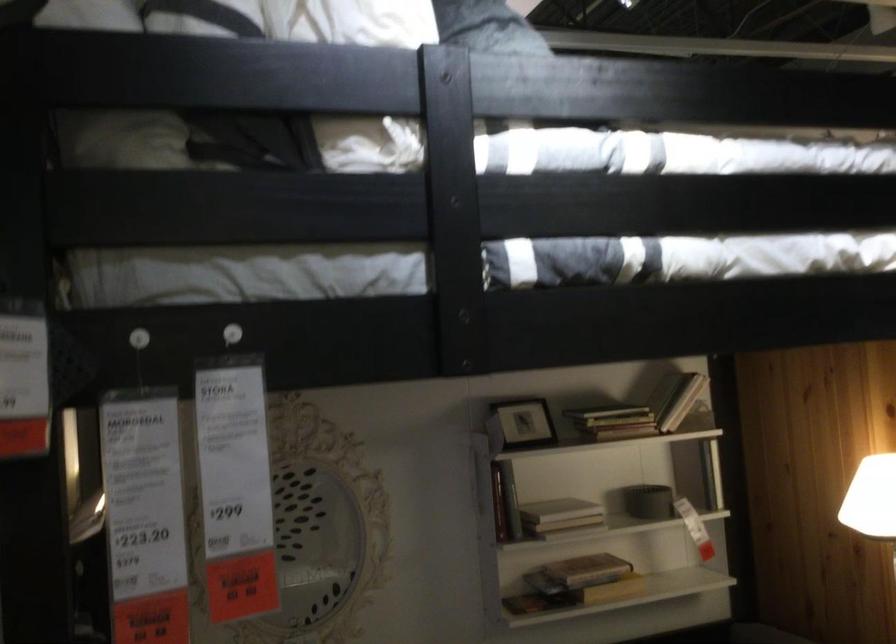
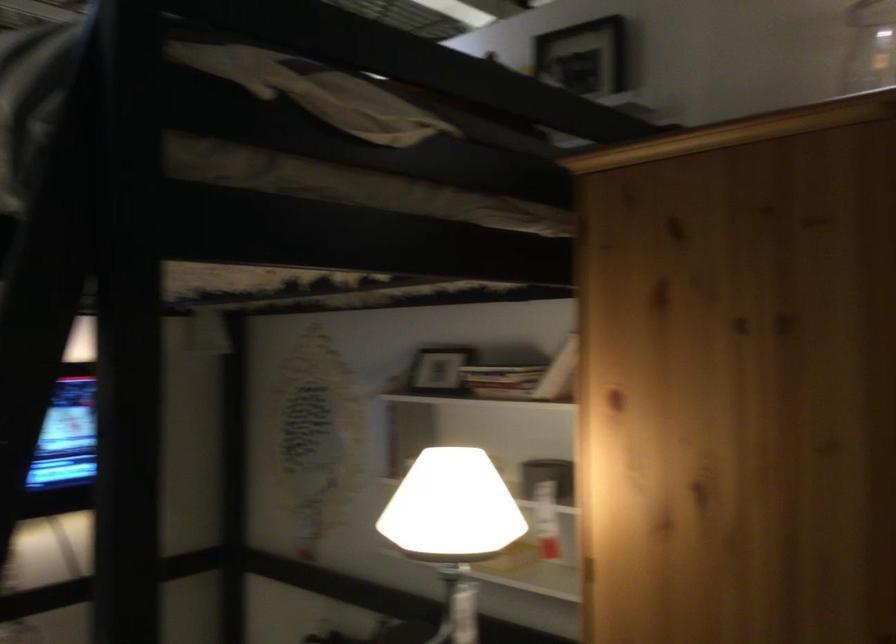
In the second image, find the point that corresponds to the point at 538,421 in the first image.

(435, 372)